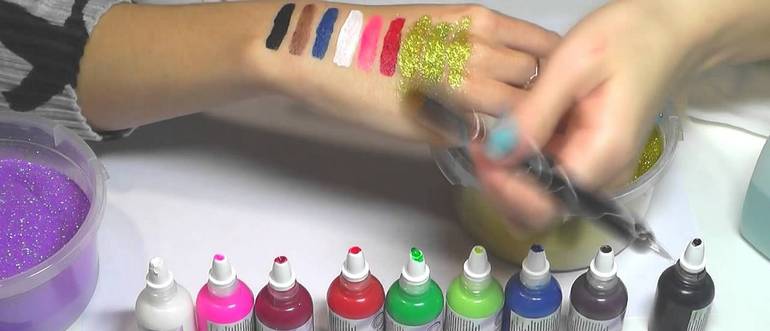
I want to click on paint, so click(176, 298), click(221, 300), click(283, 309), click(363, 299), click(417, 305), click(473, 301), click(546, 298), click(600, 298), click(688, 299).